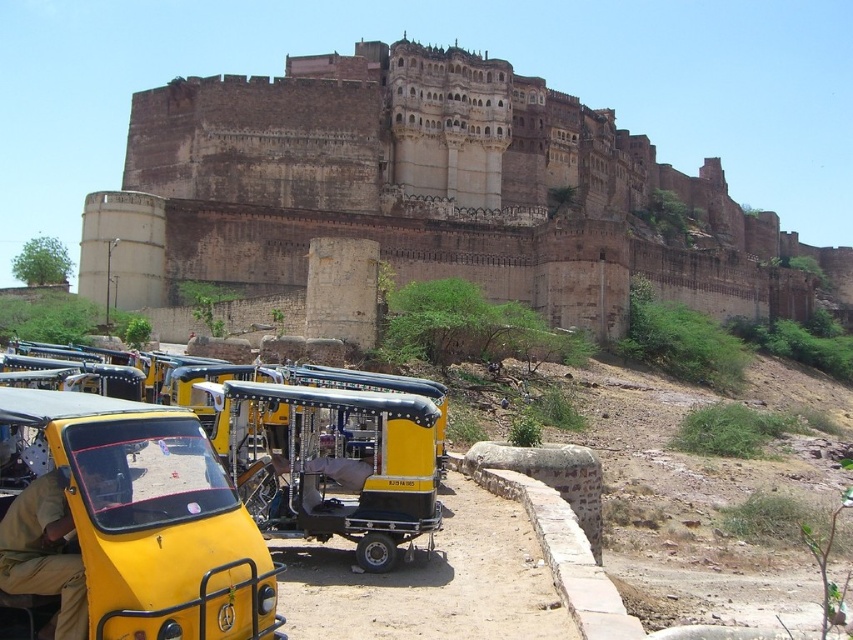
Can you confirm if brown stone castle at upper center is smaller than khaki fabric shirt at lower left?

Actually, brown stone castle at upper center might be larger than khaki fabric shirt at lower left.

Is brown stone castle at upper center taller than khaki fabric shirt at lower left?

Yes, brown stone castle at upper center is taller than khaki fabric shirt at lower left.

Does point (357, 100) come farther from viewer compared to point (4, 570)?

That is True.

The height and width of the screenshot is (640, 853). I want to click on brown stone castle at upper center, so click(x=428, y=193).

Measure the distance from yellow matte auto-rickshaw at lower left to khaki fabric shirt at lower left.

The distance of yellow matte auto-rickshaw at lower left from khaki fabric shirt at lower left is 1.87 meters.

Is point (10, 627) positioned in front of point (30, 552)?

Yes.

The image size is (853, 640). I want to click on yellow matte auto-rickshaw at lower left, so click(123, 525).

Does point (193, 456) come behind point (349, 486)?

That is False.

Who is more distant from viewer, [183,422] or [273,465]?

Positioned behind is point [273,465].

Which is in front, point (12, 513) or point (279, 456)?

Point (12, 513) is in front.

Where is `yellow matte auto-rickshaw at lower left`? yellow matte auto-rickshaw at lower left is located at coordinates (123, 525).